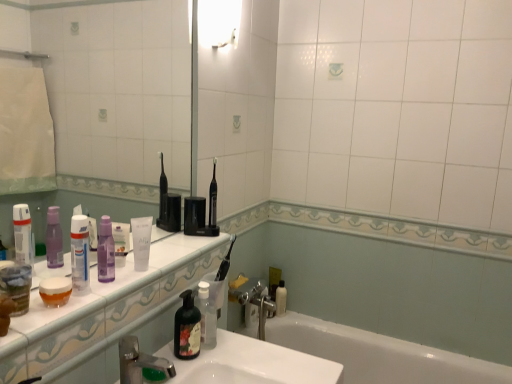
Find the location of `translucent plastic soap dispenser at lower center, the fourth toiletry positioned from the front`. translucent plastic soap dispenser at lower center, the fourth toiletry positioned from the front is located at coordinates (207, 316).

Describe the element at coordinates (207, 316) in the screenshot. This screenshot has height=384, width=512. I see `translucent plastic soap dispenser at lower center, which is the fourth toiletry in left-to-right order` at that location.

In order to click on white glossy sink at lower center in this screenshot , I will do `click(251, 363)`.

This screenshot has width=512, height=384. In order to click on transparent plastic mirror at upper left in this screenshot , I will do `click(115, 93)`.

The width and height of the screenshot is (512, 384). I want to click on translucent plastic soap dispenser at lower center, the 2th toiletry viewed from the right, so click(x=207, y=316).

From the image's perspective, does purple matte bottle at center appear lower than white glossy countertop at lower left?

No.

Does point (99, 276) come in front of point (60, 346)?

That is False.

Is purple matte bottle at center not near white glossy countertop at lower left?

purple matte bottle at center is near white glossy countertop at lower left, not far away.

Could you measure the distance between white glossy bathtub at lower center and transparent plastic mirror at upper left?

4.67 feet.

Is transparent plastic mirror at upper left at the back of white glossy bathtub at lower center?

No, white glossy bathtub at lower center's orientation is not away from transparent plastic mirror at upper left.

From the picture: Considering the relative positions of white glossy bathtub at lower center and transparent plastic mirror at upper left in the image provided, is white glossy bathtub at lower center to the left of transparent plastic mirror at upper left from the viewer's perspective?

Incorrect, white glossy bathtub at lower center is not on the left side of transparent plastic mirror at upper left.

From the image's perspective, is white glossy bathtub at lower center located above or below transparent plastic mirror at upper left?

From the image's perspective, white glossy bathtub at lower center appears below transparent plastic mirror at upper left.

Find the location of a particular element. The height and width of the screenshot is (384, 512). the 1st mouthwash to the left of the silver metallic faucet at lower center, counting from the anchor's position is located at coordinates (121, 242).

Which is closer to the camera, (128, 236) or (122, 362)?

Clearly, point (128, 236) is more distant from the camera than point (122, 362).

Is purple translucent mouthwash at center, acting as the first mouthwash starting from the right, looking in the opposite direction of silver metallic faucet at lower center?

No, purple translucent mouthwash at center, acting as the first mouthwash starting from the right,'s orientation is not away from silver metallic faucet at lower center.

Could silver metallic faucet at lower center be considered to be inside purple translucent mouthwash at center, the 2th mouthwash ordered from the bottom?

Definitely not — silver metallic faucet at lower center is not inside purple translucent mouthwash at center, the 2th mouthwash ordered from the bottom.

Considering the relative sizes of purple translucent mouthwash at center, the second mouthwash viewed from the front, and purple matte bottle at center in the image provided, is purple translucent mouthwash at center, the second mouthwash viewed from the front, wider than purple matte bottle at center?

No, purple translucent mouthwash at center, the second mouthwash viewed from the front, is not wider than purple matte bottle at center.

Does purple translucent mouthwash at center, the 1th mouthwash in the back-to-front sequence, have a greater height compared to purple matte bottle at center?

No, purple translucent mouthwash at center, the 1th mouthwash in the back-to-front sequence, is not taller than purple matte bottle at center.

Does point (122, 226) appear closer or farther from the camera than point (97, 257)?

Point (122, 226) is farther from the camera than point (97, 257).

Locate an element on the screen. The height and width of the screenshot is (384, 512). bottle above the purple translucent mouthwash at center, which is the 2th mouthwash from left to right (from a real-world perspective) is located at coordinates pos(105,251).

Find the location of `mirror on the left side of silver metallic faucet at lower center`. mirror on the left side of silver metallic faucet at lower center is located at coordinates (115, 93).

Which is in front, point (82, 76) or point (133, 353)?

The point (133, 353) is in front.

Can you tell me how much transparent plastic mirror at upper left and silver metallic faucet at lower center differ in facing direction?

0.0375 degrees separate the facing orientations of transparent plastic mirror at upper left and silver metallic faucet at lower center.

In the scene shown: Considering the sizes of objects transparent plastic mirror at upper left and silver metallic faucet at lower center in the image provided, who is thinner, transparent plastic mirror at upper left or silver metallic faucet at lower center?

With smaller width is transparent plastic mirror at upper left.

Are transparent plastic bottle at left, which is the first toiletry from front to back, and white glossy sink at lower center far apart?

No, there isn't a large distance between transparent plastic bottle at left, which is the first toiletry from front to back, and white glossy sink at lower center.

Can white glossy sink at lower center be found inside transparent plastic bottle at left, which ranks as the 5th toiletry in right-to-left order?

No.

Which is more to the left, transparent plastic bottle at left, which is counted as the 1th toiletry, starting from the left, or white glossy sink at lower center?

Positioned to the left is transparent plastic bottle at left, which is counted as the 1th toiletry, starting from the left.

Is transparent plastic bottle at left, which is the 5th toiletry in back-to-front order, facing away from white glossy sink at lower center?

transparent plastic bottle at left, which is the 5th toiletry in back-to-front order, does not have its back to white glossy sink at lower center.

From the image's perspective, is white matte tube at center, placed as the 2th toiletry when sorted from left to right, positioned above or below white glossy bathtub at lower center?

Clearly, from the image's perspective, white matte tube at center, placed as the 2th toiletry when sorted from left to right, is above white glossy bathtub at lower center.

Can you confirm if white matte tube at center, placed as the second toiletry when sorted from front to back, is positioned to the left of white glossy bathtub at lower center?

Indeed, white matte tube at center, placed as the second toiletry when sorted from front to back, is positioned on the left side of white glossy bathtub at lower center.

How different are the orientations of white matte tube at center, which appears as the 4th toiletry when viewed from the back, and white glossy bathtub at lower center in degrees?

67 degrees separate the facing orientations of white matte tube at center, which appears as the 4th toiletry when viewed from the back, and white glossy bathtub at lower center.

At what (x,y) coordinates should I click in order to perform the action: click on bottle on the left of white glossy countertop at lower left. Please return your answer as a coordinate pair (x, y). Looking at the image, I should click on (105, 251).

Find the location of a particular element. bathtub located below the transparent plastic mirror at upper left (from the image's perspective) is located at coordinates (379, 354).

Looking at the image, which one is located further to white matte tube at center, placed as the second toiletry when sorted from front to back, silver metallic faucet at lower center or white glossy countertop at lower left?

silver metallic faucet at lower center.

Considering their positions, is white glossy sink at lower center positioned closer to translucent plastic jar at lower left, the second mouthwash when ordered from right to left, than white matte tube at center, placed as the 2th toiletry when sorted from left to right?

white matte tube at center, placed as the 2th toiletry when sorted from left to right, is positioned closer to the anchor translucent plastic jar at lower left, the second mouthwash when ordered from right to left.

Estimate the real-world distances between objects in this image. Which object is further from purple matte bottle at center, white glossy bathtub at lower center or green matte soap dispenser at center, arranged as the 3th toiletry when viewed from the front?

Among the two, white glossy bathtub at lower center is located further to purple matte bottle at center.

Which object lies nearer to the anchor point silver metallic faucet at lower center, white glossy countertop at lower left or translucent plastic soap dispenser at lower center, which is the second toiletry from back to front?

Among the two, white glossy countertop at lower left is located nearer to silver metallic faucet at lower center.

Looking at the image, which one is located further to black plastic toothbrush at center, white matte tube at center, placed as the 2th toiletry when sorted from left to right, or translucent plastic jar at lower left, which appears as the second mouthwash when viewed from the back?

translucent plastic jar at lower left, which appears as the second mouthwash when viewed from the back, lies further to black plastic toothbrush at center than the other object.

When comparing their distances from purple translucent mouthwash at center, acting as the first mouthwash starting from the right, does white glossy light fixture at upper center or white matte bottle at lower center, the fifth toiletry when ordered from front to back, seem closer?

white glossy light fixture at upper center.

Based on the photo, when comparing their distances from white glossy light fixture at upper center, does transparent plastic bottle at left, which ranks as the 5th toiletry in right-to-left order, or translucent plastic soap dispenser at lower center, the 2th toiletry viewed from the right, seem closer?

Based on the image, transparent plastic bottle at left, which ranks as the 5th toiletry in right-to-left order, appears to be nearer to white glossy light fixture at upper center.

From the image, which object appears to be farther from white glossy countertop at lower left, white glossy sink at lower center or white matte bottle at lower center, which is the first toiletry in right-to-left order?

The object further to white glossy countertop at lower left is white matte bottle at lower center, which is the first toiletry in right-to-left order.

The width and height of the screenshot is (512, 384). I want to click on tap located between transparent plastic bottle at left, which is the 5th toiletry in back-to-front order, and white glossy bathtub at lower center in the left-right direction, so click(x=140, y=362).

Locate an element on the screen. The image size is (512, 384). tap between white glossy light fixture at upper center and white glossy bathtub at lower center vertically is located at coordinates pos(140,362).

This screenshot has width=512, height=384. Identify the location of toiletry between purple translucent mouthwash at center, the second mouthwash viewed from the front, and white matte bottle at lower center, the 5th toiletry in the left-to-right sequence, from front to back. (207, 316).

The width and height of the screenshot is (512, 384). I want to click on bathtub between white matte tube at center, placed as the second toiletry when sorted from front to back, and white matte bottle at lower center, the first toiletry viewed from the back, from front to back, so click(x=379, y=354).